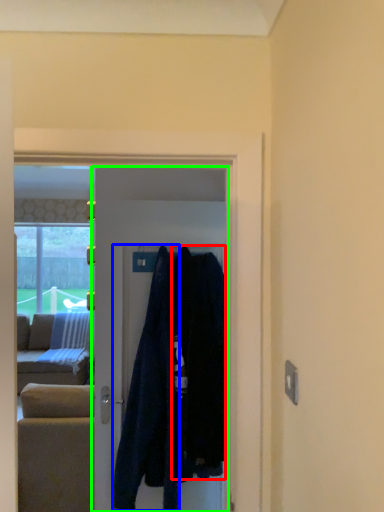
Question: Which object is the closest to the clothing (highlighted by a red box)? Choose among these: clothing (highlighted by a blue box) or door (highlighted by a green box).

Choices:
 (A) clothing
 (B) door

Answer: (A)